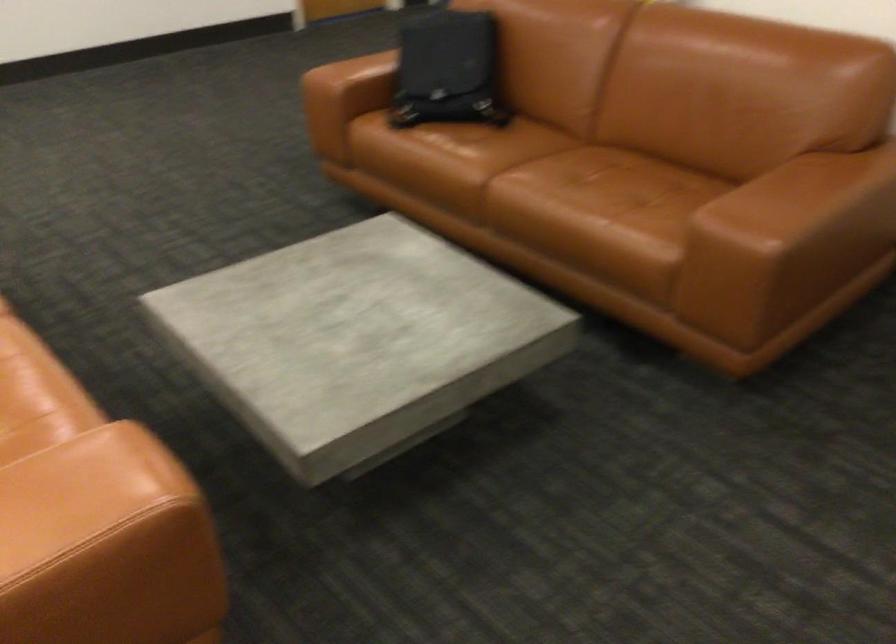
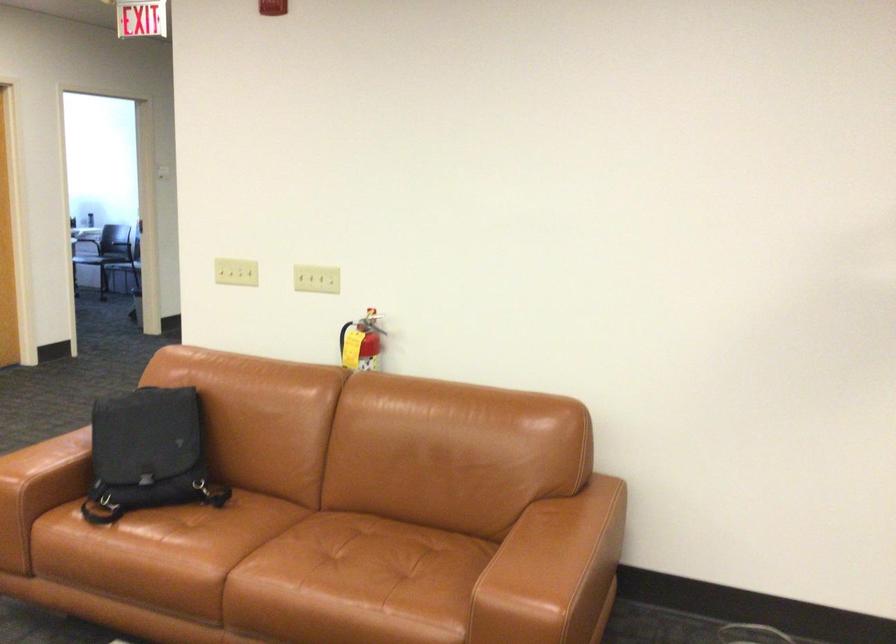
Locate, in the second image, the point that corresponds to (395,114) in the first image.

(92, 514)